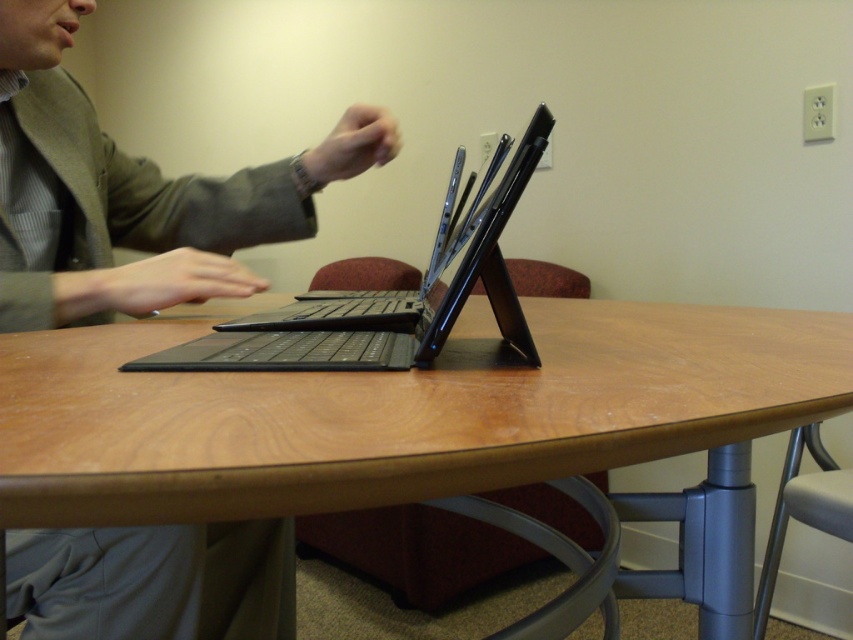
You are setting up a workspace and have both the matte black laptop at center and the black matte laptop at center on your desk. Which one has a larger width?

The matte black laptop at center has a larger width than the black matte laptop at center according to the description.

You are a delivery person who needs to place a matte black laptop at center into a box that can only accommodate items within 25 inches in length. Based on the scene, can you safely put the laptop into the box?

The matte black laptop at center is 26.04 inches away from the viewer, which means its actual length might be longer than 25 inches. Therefore, it may not fit into the box designed for items within 25 inches in length.

You are a delivery person who needs to place a package at the exact midpoint between the two points marked as point A and point B. The coordinates given are point A at (83, 400) and point B at 0.375, 0.902. Calculate the midpoint coordinates to ensure accurate delivery. Remember, the midpoint formula is average of x and y coordinates. What are the coordinates of the midpoint?

The midpoint coordinates between point A at (83, 400) and point B at 0.375, 0.902 are calculated by averaging the x and y values. The x coordinate is 0.5 and the y coordinate is 0.5, so the midpoint is at 0.5, 0.5.